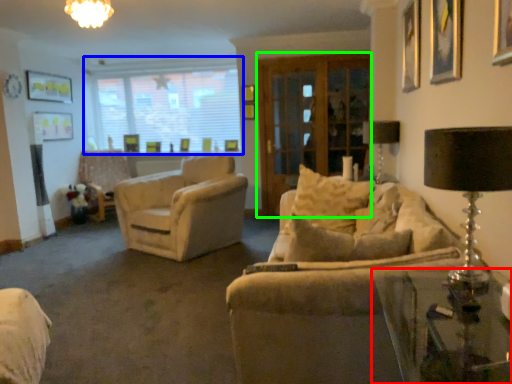
Question: Which object is positioned farthest from table (highlighted by a red box)? Select from window (highlighted by a blue box) and screen door (highlighted by a green box).

Choices:
 (A) window
 (B) screen door

Answer: (A)